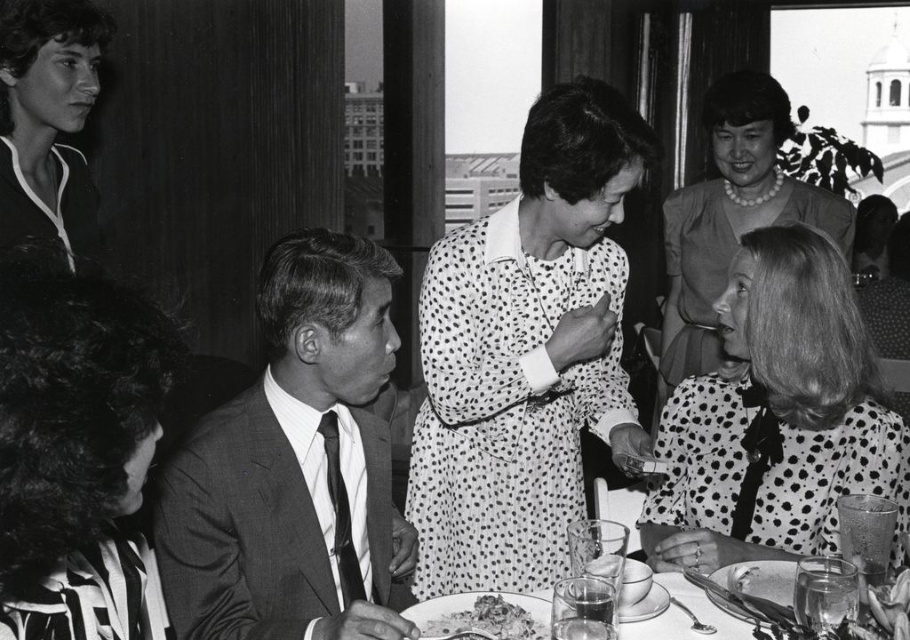
Is striped fabric blouse at lower left to the left of polka dot dress at center from the viewer's perspective?

Yes, striped fabric blouse at lower left is to the left of polka dot dress at center.

Looking at this image, does striped fabric blouse at lower left have a larger size compared to polka dot dress at center?

No, striped fabric blouse at lower left is not bigger than polka dot dress at center.

At what (x,y) coordinates should I click in order to perform the action: click on striped fabric blouse at lower left. Please return your answer as a coordinate pair (x, y). Image resolution: width=910 pixels, height=640 pixels. Looking at the image, I should click on (76, 451).

Image resolution: width=910 pixels, height=640 pixels. I want to click on striped fabric blouse at lower left, so click(76, 451).

Is white dotted dress at center thinner than spotted fabric blouse at lower right?

No.

Which is more to the right, white dotted dress at center or spotted fabric blouse at lower right?

Positioned to the right is spotted fabric blouse at lower right.

Does point (493, 424) come in front of point (784, 316)?

No.

Locate an element on the screen. white dotted dress at center is located at coordinates (526, 353).

Between striped fabric blouse at lower left and crumbly brown bread at lower center, which one has more height?

striped fabric blouse at lower left

Between striped fabric blouse at lower left and crumbly brown bread at lower center, which one has less height?

crumbly brown bread at lower center is shorter.

This screenshot has height=640, width=910. In order to click on striped fabric blouse at lower left in this screenshot , I will do `click(76, 451)`.

Locate an element on the screen. striped fabric blouse at lower left is located at coordinates [x=76, y=451].